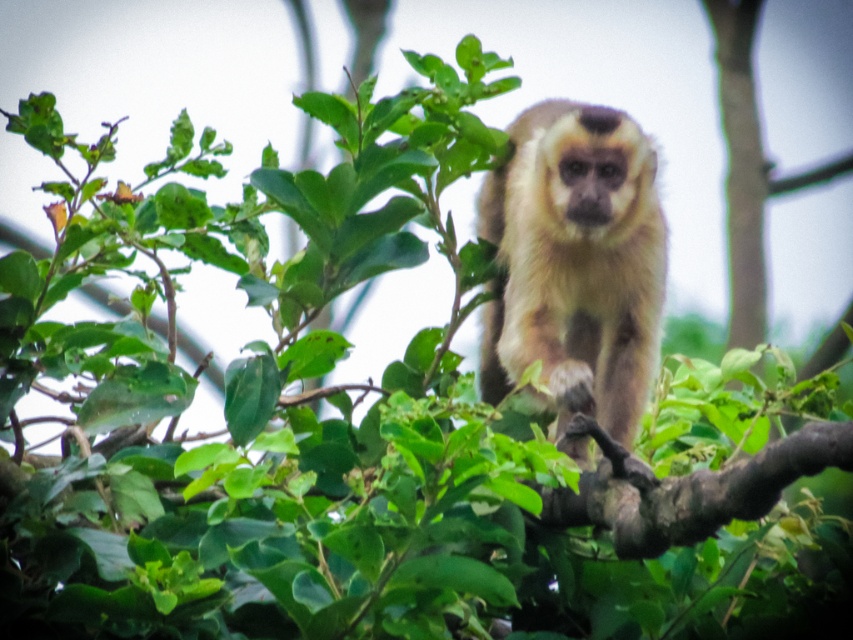
Can you confirm if fuzzy beige monkey at center is bigger than brown rough tree branch at center?

Yes.

Locate an element on the screen. fuzzy beige monkey at center is located at coordinates (575, 262).